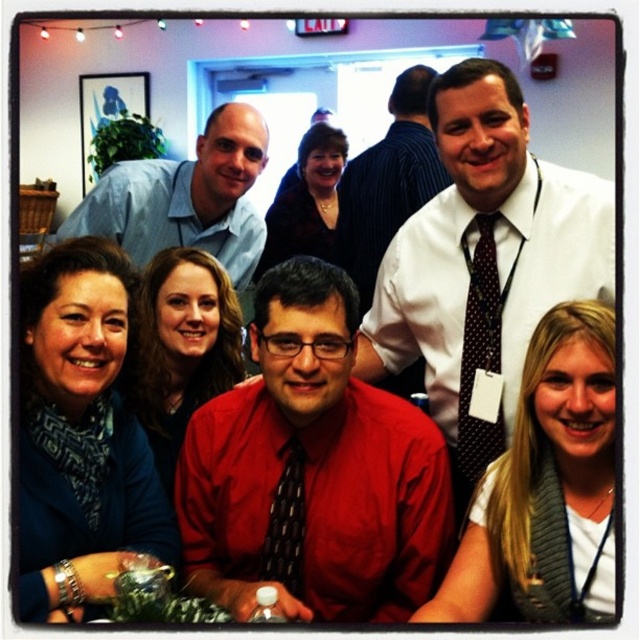
Question: Can you confirm if red satin shirt at center is bigger than matte black sweater at center?

Choices:
 (A) no
 (B) yes

Answer: (A)

Question: Which object appears closest to the camera in this image?

Choices:
 (A) white shirt at upper center
 (B) black dotted tie at center
 (C) light brown hair at center
 (D) white dress shirt at upper right

Answer: (C)

Question: Among these points, which one is farthest from the camera?

Choices:
 (A) (90, 493)
 (B) (211, 218)
 (C) (394, 195)

Answer: (C)

Question: Does blue patterned scarf at lower left have a smaller size compared to light brown hair at center?

Choices:
 (A) no
 (B) yes

Answer: (A)

Question: Is matte black sweater at center closer to camera compared to black dotted tie at center?

Choices:
 (A) yes
 (B) no

Answer: (B)

Question: Which object is closer to the camera taking this photo?

Choices:
 (A) light brown hair at center
 (B) matte black sweater at center

Answer: (A)